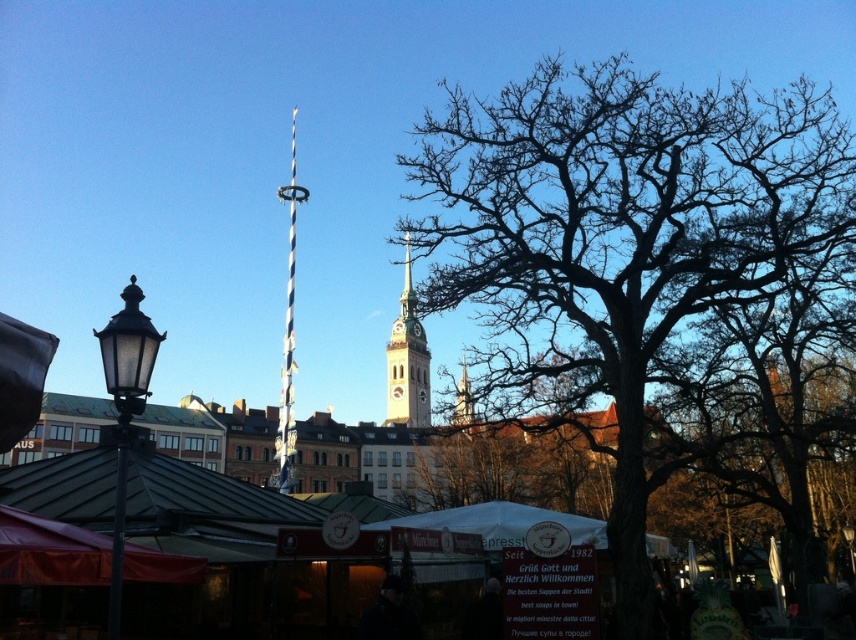
Question: Which point is farther to the camera?

Choices:
 (A) (111, 320)
 (B) (51, 541)

Answer: (B)

Question: Is red fabric canopy at lower left below matte black lamp post at left?

Choices:
 (A) no
 (B) yes

Answer: (B)

Question: Can you confirm if red fabric canopy at lower left is smaller than blue and white striped pole at center?

Choices:
 (A) yes
 (B) no

Answer: (A)

Question: Among these objects, which one is farthest from the camera?

Choices:
 (A) white fabric canopy at center
 (B) blue and white striped pole at center
 (C) matte black lamp post at left

Answer: (B)

Question: Which point appears closest to the camera in this image?

Choices:
 (A) (388, 400)
 (B) (525, 516)
 (C) (813, 141)

Answer: (B)

Question: Considering the relative positions of red fabric canopy at lower left and matte black lamp post at left in the image provided, where is red fabric canopy at lower left located with respect to matte black lamp post at left?

Choices:
 (A) above
 (B) below

Answer: (B)